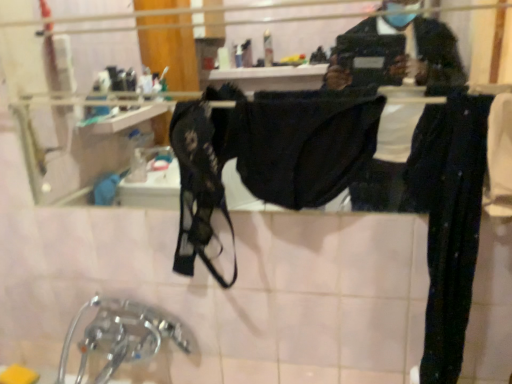
The height and width of the screenshot is (384, 512). What do you see at coordinates (119, 336) in the screenshot?
I see `chrome metallic faucet at lower left` at bounding box center [119, 336].

I want to click on chrome metallic faucet at lower left, so click(x=119, y=336).

The height and width of the screenshot is (384, 512). I want to click on chrome metallic faucet at lower left, so click(x=119, y=336).